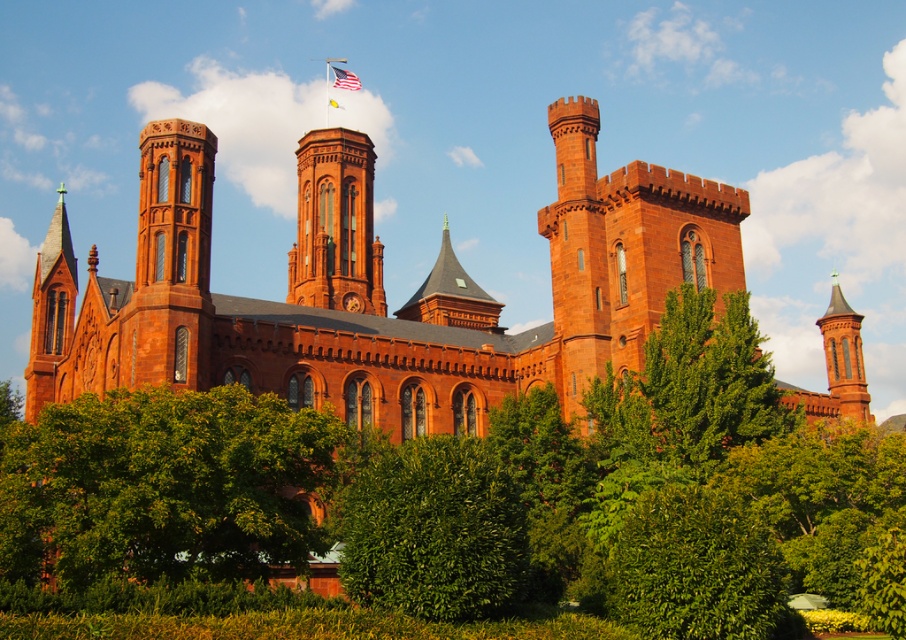
Question: Is matte brick church at center closer to camera compared to green leafy bush at center?

Choices:
 (A) yes
 (B) no

Answer: (B)

Question: Among these points, which one is nearest to the camera?

Choices:
 (A) (413, 426)
 (B) (167, 388)

Answer: (B)

Question: Is matte brick tower at center below silky fabric flag at upper center?

Choices:
 (A) yes
 (B) no

Answer: (A)

Question: Is matte brick church at center thinner than green leafy bush at center?

Choices:
 (A) yes
 (B) no

Answer: (B)

Question: Which object appears farthest from the camera in this image?

Choices:
 (A) matte brick tower at center
 (B) american flag at center

Answer: (B)

Question: Which of the following is the farthest from the observer?

Choices:
 (A) (338, 106)
 (B) (344, 160)
 (C) (281, 426)

Answer: (A)